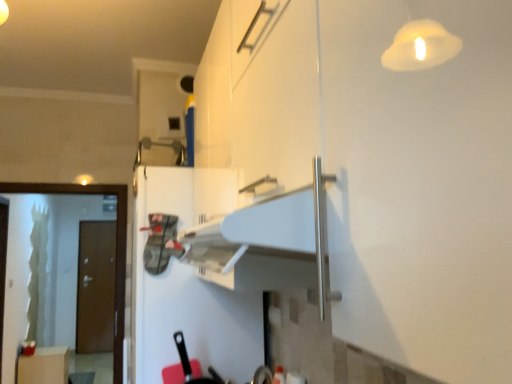
Question: From a real-world perspective, is green frosted glass screen door at left beneath matte white cabinet at lower left?

Choices:
 (A) no
 (B) yes

Answer: (A)

Question: Considering the relative sizes of green frosted glass screen door at left and matte white cabinet at lower left in the image provided, is green frosted glass screen door at left wider than matte white cabinet at lower left?

Choices:
 (A) no
 (B) yes

Answer: (A)

Question: Can you confirm if green frosted glass screen door at left is positioned to the right of matte white cabinet at lower left?

Choices:
 (A) yes
 (B) no

Answer: (A)

Question: Is green frosted glass screen door at left outside of matte white cabinet at lower left?

Choices:
 (A) no
 (B) yes

Answer: (B)

Question: Is green frosted glass screen door at left behind matte white cabinet at lower left?

Choices:
 (A) yes
 (B) no

Answer: (B)

Question: In the image, is brown matte door at left positioned in front of or behind matte white cabinet at lower left?

Choices:
 (A) behind
 (B) front

Answer: (A)

Question: Is brown matte door at left to the left or to the right of matte white cabinet at lower left in the image?

Choices:
 (A) right
 (B) left

Answer: (B)

Question: From the image's perspective, relative to matte white cabinet at lower left, is brown matte door at left above or below?

Choices:
 (A) below
 (B) above

Answer: (B)

Question: From a real-world perspective, is brown matte door at left physically located above or below matte white cabinet at lower left?

Choices:
 (A) above
 (B) below

Answer: (A)

Question: In terms of width, does brown matte door at left look wider or thinner when compared to white matte refrigerator at center?

Choices:
 (A) wide
 (B) thin

Answer: (B)

Question: From a real-world perspective, relative to white matte refrigerator at center, is brown matte door at left vertically above or below?

Choices:
 (A) below
 (B) above

Answer: (A)

Question: Is brown matte door at left in front of or behind white matte refrigerator at center in the image?

Choices:
 (A) front
 (B) behind

Answer: (B)

Question: Which is correct: brown matte door at left is inside white matte refrigerator at center, or outside of it?

Choices:
 (A) outside
 (B) inside

Answer: (A)

Question: Is green frosted glass screen door at left to the left or to the right of white matte refrigerator at center in the image?

Choices:
 (A) right
 (B) left

Answer: (B)

Question: In terms of height, does green frosted glass screen door at left look taller or shorter compared to white matte refrigerator at center?

Choices:
 (A) short
 (B) tall

Answer: (B)